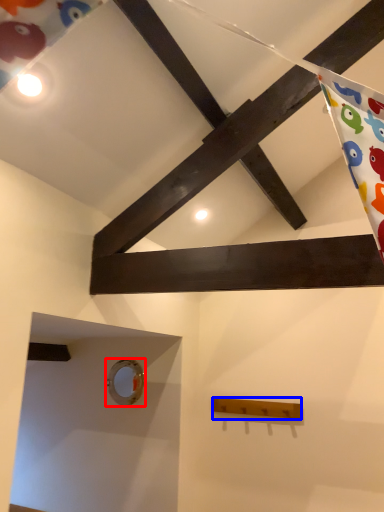
Question: Which object is further to the camera taking this photo, hole (highlighted by a red box) or plank (highlighted by a blue box)?

Choices:
 (A) hole
 (B) plank

Answer: (A)